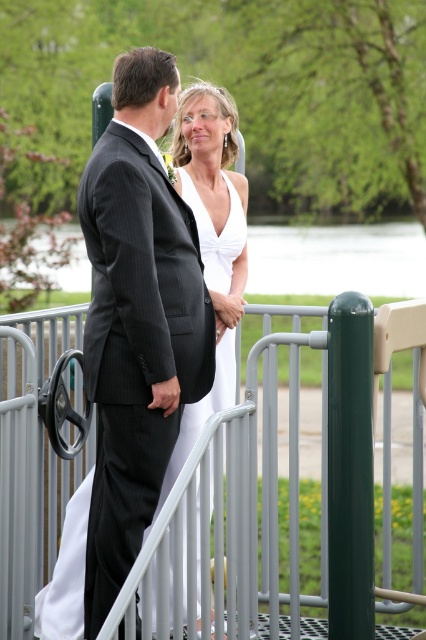
Question: Considering the real-world distances, which object is closest to the matte black suit at center?

Choices:
 (A) silver metallic railing at center
 (B) white satin dress at center

Answer: (B)

Question: Which point appears closest to the camera in this image?

Choices:
 (A) (144, 440)
 (B) (224, 403)
 (C) (396, 604)

Answer: (A)

Question: Which point is farther to the camera?

Choices:
 (A) white satin dress at center
 (B) silver metallic railing at center

Answer: (A)

Question: Can you confirm if silver metallic railing at center is positioned below white satin dress at center?

Choices:
 (A) yes
 (B) no

Answer: (A)

Question: Is matte black suit at center above white satin dress at center?

Choices:
 (A) no
 (B) yes

Answer: (B)

Question: Does silver metallic railing at center have a smaller size compared to matte black suit at center?

Choices:
 (A) yes
 (B) no

Answer: (B)